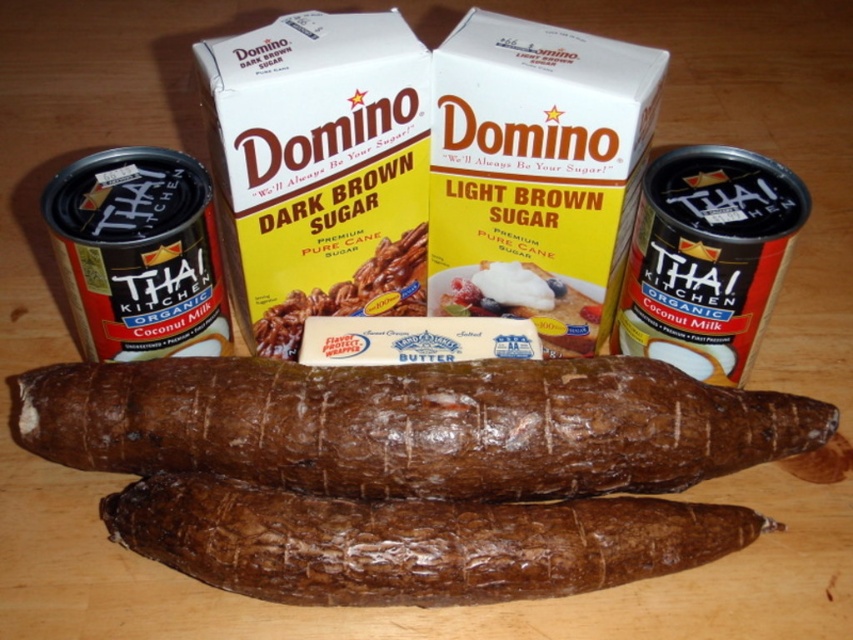
Does dark brown sugar at center have a lesser width compared to buttery smooth butter at center?

No, dark brown sugar at center is not thinner than buttery smooth butter at center.

Can you confirm if dark brown sugar at center is bigger than buttery smooth butter at center?

Yes, dark brown sugar at center is bigger than buttery smooth butter at center.

Is point (392, 250) more distant than point (509, 289)?

No, it is not.

Find the location of a particular element. This screenshot has height=640, width=853. dark brown sugar at center is located at coordinates pyautogui.click(x=352, y=294).

Who is lower down, brown rough textured yams at bottom or buttery smooth butter at center?

brown rough textured yams at bottom is lower down.

Can you confirm if brown rough textured yams at bottom is positioned below buttery smooth butter at center?

Correct, brown rough textured yams at bottom is located below buttery smooth butter at center.

Who is more distant from viewer, (424,502) or (514,262)?

Point (514,262)

The width and height of the screenshot is (853, 640). I want to click on brown rough textured yams at bottom, so click(413, 541).

Is brown rough textured yams at bottom taller than dark brown sugar at center?

Incorrect, brown rough textured yams at bottom's height is not larger of dark brown sugar at center's.

Consider the image. Who is positioned more to the left, brown rough textured yams at bottom or dark brown sugar at center?

Positioned to the left is dark brown sugar at center.

Measure the distance between brown rough textured yams at bottom and camera.

A distance of 39.05 inches exists between brown rough textured yams at bottom and camera.

Identify the location of brown rough textured yams at bottom. (413, 541).